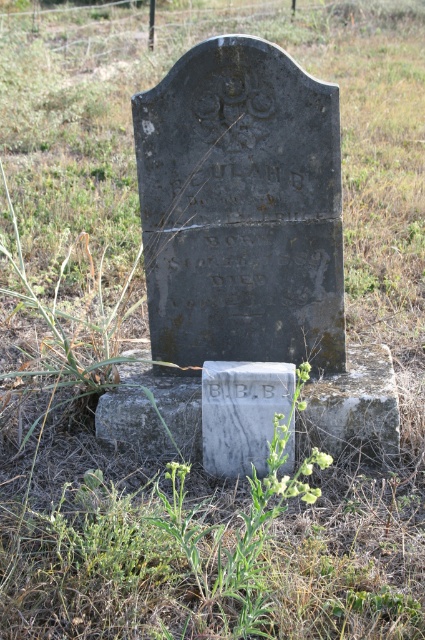
Question: Among these objects, which one is nearest to the camera?

Choices:
 (A) white marble gravestone at center
 (B) green leafy weed at center

Answer: (B)

Question: Which point is closer to the camera?

Choices:
 (A) (314, 449)
 (B) (283, 408)

Answer: (B)

Question: Can you confirm if green leafy weed at center is positioned below white marble gravestone at center?

Choices:
 (A) yes
 (B) no

Answer: (A)

Question: Which object appears closest to the camera in this image?

Choices:
 (A) white marble gravestone at center
 (B) green leafy weed at center

Answer: (B)

Question: Does green leafy weed at center lie behind white marble gravestone at center?

Choices:
 (A) no
 (B) yes

Answer: (A)

Question: Does green leafy weed at center appear over white marble gravestone at center?

Choices:
 (A) yes
 (B) no

Answer: (B)